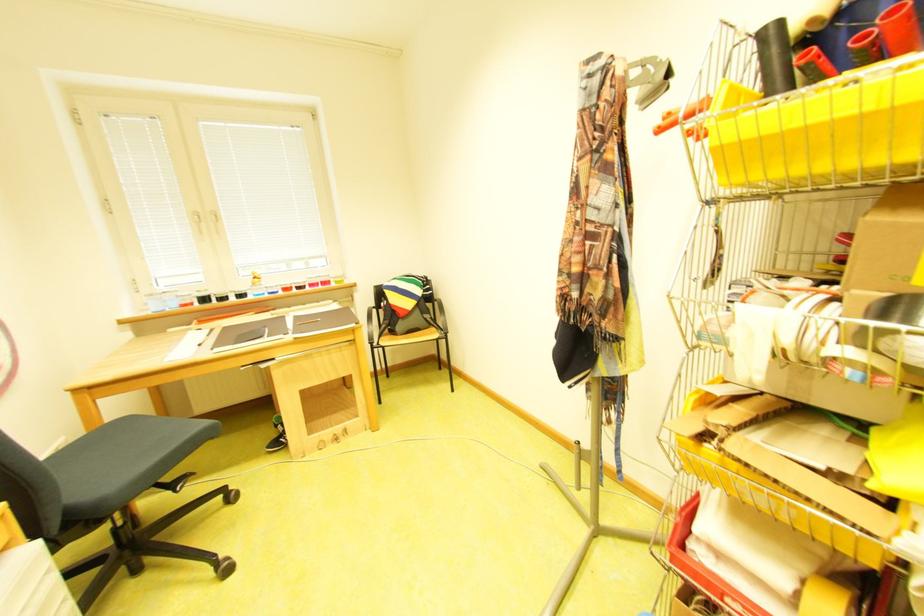
This screenshot has height=616, width=924. Identify the location of red cylindrical holder. (761, 562).